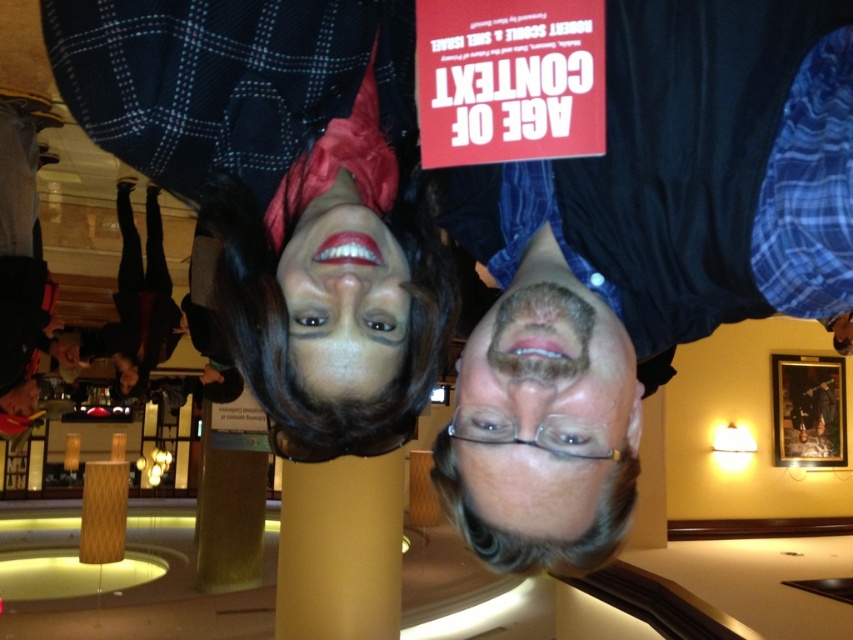
Question: Is dark blue shirt at center closer to camera compared to gray hair at center?

Choices:
 (A) yes
 (B) no

Answer: (A)

Question: Considering the relative positions of dark blue shirt at center and gray hair at center in the image provided, where is dark blue shirt at center located with respect to gray hair at center?

Choices:
 (A) left
 (B) right

Answer: (B)

Question: Among these points, which one is nearest to the camera?

Choices:
 (A) (357, 307)
 (B) (538, 413)

Answer: (B)

Question: Which object is farther from the camera taking this photo?

Choices:
 (A) gray hair at center
 (B) dark blue shirt at center

Answer: (A)

Question: Can you confirm if gray hair at center is positioned above matte black wig at center?

Choices:
 (A) no
 (B) yes

Answer: (A)

Question: Which point is closer to the camera?

Choices:
 (A) dark blue shirt at center
 (B) matte black wig at center

Answer: (A)